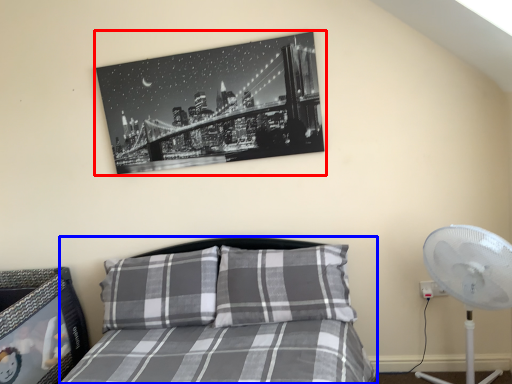
Question: Which of the following is the farthest to the observer, picture frame (highlighted by a red box) or bed (highlighted by a blue box)?

Choices:
 (A) picture frame
 (B) bed

Answer: (A)